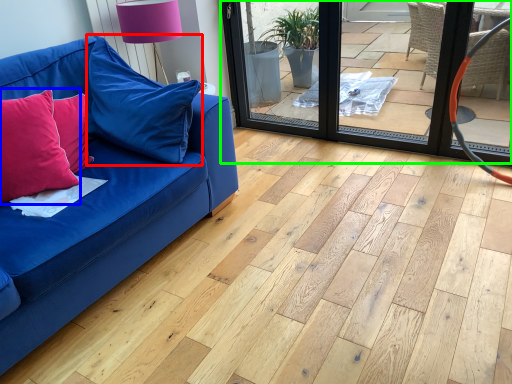
Question: Considering the real-world distances, which object is closest to pillow (highlighted by a red box)? pillow (highlighted by a blue box) or screen door (highlighted by a green box).

Choices:
 (A) pillow
 (B) screen door

Answer: (A)